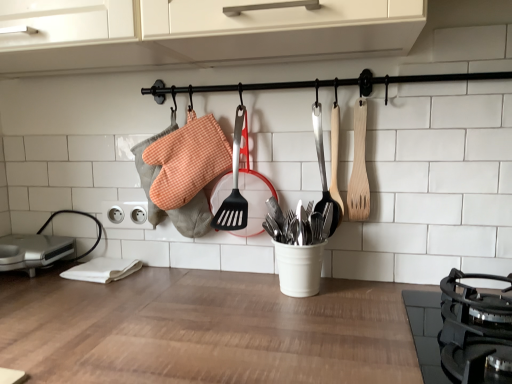
Question: Can you confirm if white plastic electrical outlet at lower left is positioned to the right of wooden spatula at center, which appears as the first spatula when viewed from the left?

Choices:
 (A) no
 (B) yes

Answer: (A)

Question: From the image's perspective, is white plastic electrical outlet at lower left below wooden spatula at center, which appears as the first spatula when viewed from the left?

Choices:
 (A) yes
 (B) no

Answer: (A)

Question: Are white plastic electrical outlet at lower left and wooden spatula at center, which appears as the first spatula when viewed from the left, far apart?

Choices:
 (A) yes
 (B) no

Answer: (B)

Question: Considering the relative sizes of white plastic electrical outlet at lower left and wooden spatula at center, the 2th spatula viewed from the right, in the image provided, is white plastic electrical outlet at lower left thinner than wooden spatula at center, the 2th spatula viewed from the right,?

Choices:
 (A) yes
 (B) no

Answer: (A)

Question: Considering the relative sizes of white plastic electrical outlet at lower left and wooden spatula at center, the 2th spatula viewed from the right, in the image provided, is white plastic electrical outlet at lower left bigger than wooden spatula at center, the 2th spatula viewed from the right,?

Choices:
 (A) no
 (B) yes

Answer: (A)

Question: From a real-world perspective, is white plastic electrical outlet at lower left positioned under wooden spatula at center, which appears as the first spatula when viewed from the left, based on gravity?

Choices:
 (A) no
 (B) yes

Answer: (B)

Question: Is black matte gas stove at lower right completely or partially outside of wooden spatula at right, which appears as the 2th spatula when viewed from the left?

Choices:
 (A) no
 (B) yes

Answer: (B)

Question: From the image's perspective, is black matte gas stove at lower right under wooden spatula at right, which appears as the 2th spatula when viewed from the left?

Choices:
 (A) no
 (B) yes

Answer: (B)

Question: Is wooden spatula at right, the 1th spatula when ordered from right to left, located within black matte gas stove at lower right?

Choices:
 (A) no
 (B) yes

Answer: (A)

Question: Is black matte gas stove at lower right taller than wooden spatula at right, which appears as the 2th spatula when viewed from the left?

Choices:
 (A) yes
 (B) no

Answer: (B)

Question: Considering the relative sizes of black matte gas stove at lower right and wooden spatula at right, which appears as the 2th spatula when viewed from the left, in the image provided, is black matte gas stove at lower right wider than wooden spatula at right, which appears as the 2th spatula when viewed from the left,?

Choices:
 (A) yes
 (B) no

Answer: (A)

Question: Is black matte gas stove at lower right not near wooden spatula at right, which appears as the 2th spatula when viewed from the left?

Choices:
 (A) yes
 (B) no

Answer: (B)

Question: From a real-world perspective, is silver metallic sandwich maker at lower left under wooden spatula at right, the 1th spatula when ordered from right to left?

Choices:
 (A) yes
 (B) no

Answer: (A)